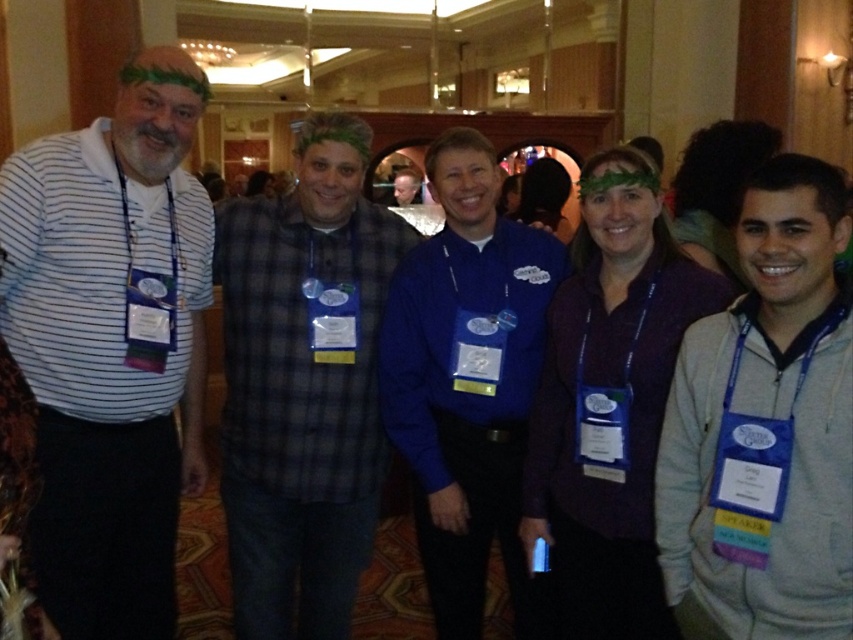
Question: Is gray fleece hoodie at right to the left of matte blue shirt at center from the viewer's perspective?

Choices:
 (A) yes
 (B) no

Answer: (B)

Question: Is white striped shirt at left behind matte blue shirt at center?

Choices:
 (A) no
 (B) yes

Answer: (A)

Question: Which point is closer to the camera taking this photo?

Choices:
 (A) [x=120, y=374]
 (B) [x=474, y=563]
 (C) [x=321, y=188]
 (D) [x=403, y=176]

Answer: (A)

Question: Which of the following is the farthest from the observer?

Choices:
 (A) (512, 410)
 (B) (158, 188)
 (C) (714, 477)
 (D) (396, 180)

Answer: (D)

Question: From the image, what is the correct spatial relationship of gray fleece hoodie at right in relation to plaid shirt at center?

Choices:
 (A) above
 (B) below

Answer: (A)

Question: Among these objects, which one is farthest from the camera?

Choices:
 (A) blue fabric shirt at center
 (B) gray fleece hoodie at right
 (C) plaid shirt at center
 (D) white striped shirt at left

Answer: (A)